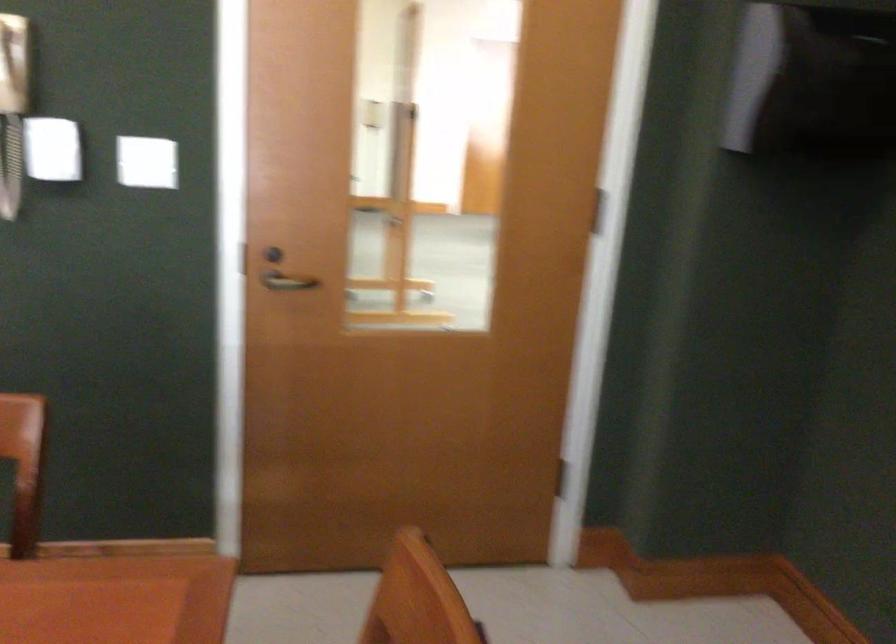
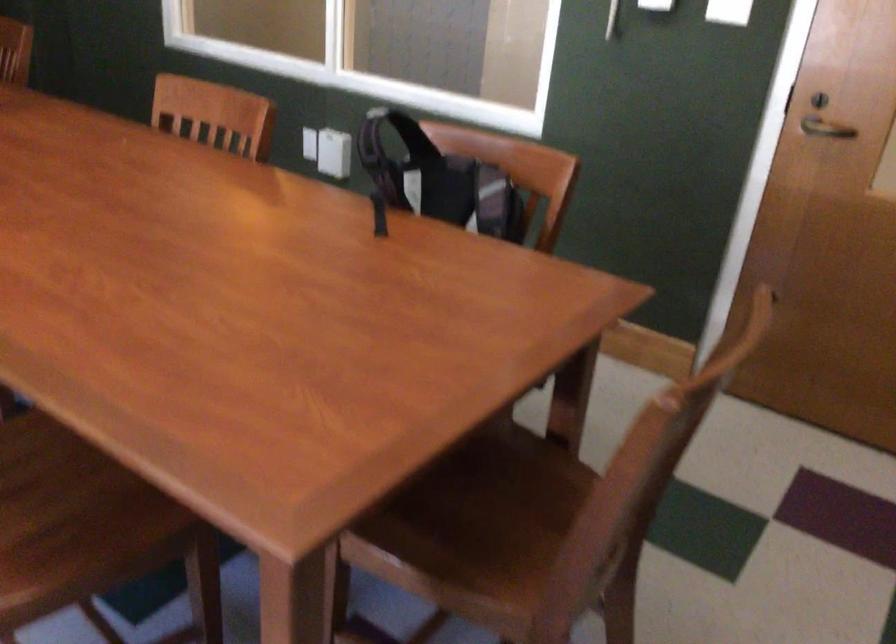
Where in the second image is the point corresponding to [280,285] from the first image?

(824, 129)